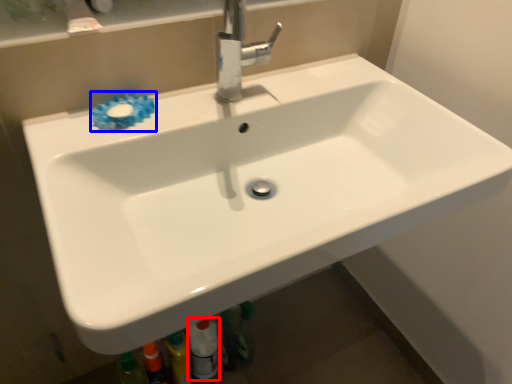
Question: Which object appears farthest to the camera in this image, toiletry (highlighted by a red box) or flower (highlighted by a blue box)?

Choices:
 (A) toiletry
 (B) flower

Answer: (A)